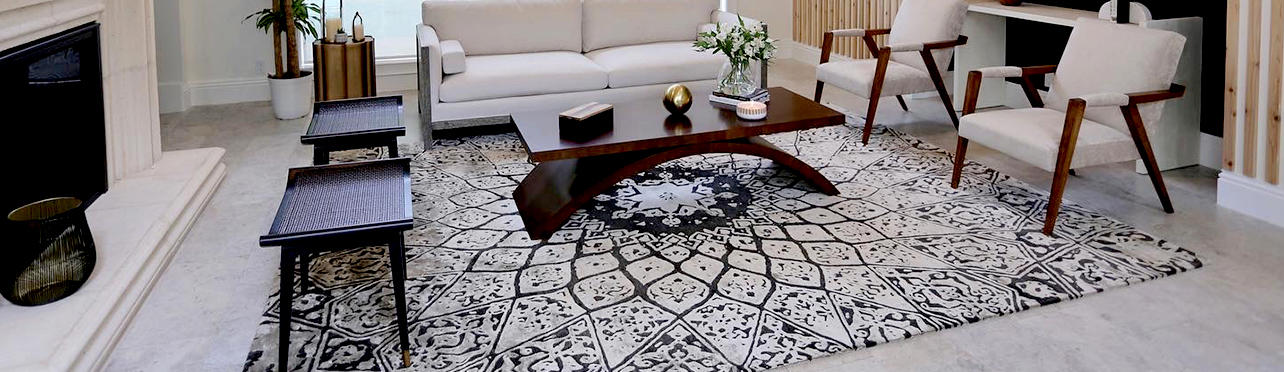
You are a GUI agent. You are given a task and a screenshot of the screen. Output one action in this format:
    pyautogui.click(x=<x>, y=<y>)
    Task: Click on the wall
    This screenshot has height=372, width=1284.
    Given the screenshot: What is the action you would take?
    pyautogui.click(x=220, y=27), pyautogui.click(x=840, y=10), pyautogui.click(x=1266, y=73)